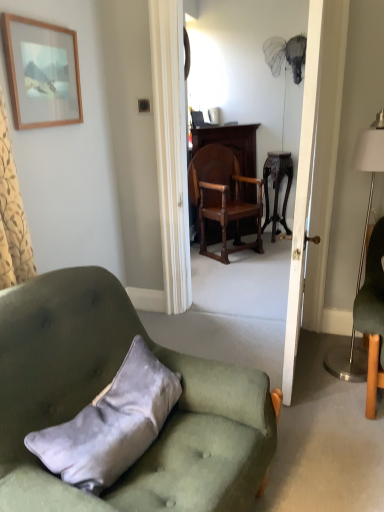
Question: Is there a large distance between silver metallic floor lamp at right and polished wood chair at center, which appears as the first chair when viewed from the top?

Choices:
 (A) yes
 (B) no

Answer: (A)

Question: Is silver metallic floor lamp at right behind polished wood chair at center, acting as the 2th chair starting from the front?

Choices:
 (A) no
 (B) yes

Answer: (A)

Question: From the image's perspective, is silver metallic floor lamp at right located above polished wood chair at center, the second chair when ordered from bottom to top?

Choices:
 (A) no
 (B) yes

Answer: (A)

Question: Is silver metallic floor lamp at right thinner than polished wood chair at center, acting as the 2th chair starting from the front?

Choices:
 (A) yes
 (B) no

Answer: (A)

Question: Would you say polished wood chair at center, the second chair when ordered from bottom to top, is part of silver metallic floor lamp at right's contents?

Choices:
 (A) no
 (B) yes

Answer: (A)

Question: Is silver metallic floor lamp at right located outside polished wood chair at center, the second chair when ordered from bottom to top?

Choices:
 (A) yes
 (B) no

Answer: (A)

Question: Can you confirm if polished wood chair at center, acting as the 2th chair starting from the front, is bigger than wooden picture frame at upper left?

Choices:
 (A) no
 (B) yes

Answer: (B)

Question: Does polished wood chair at center, the second chair when ordered from bottom to top, touch wooden picture frame at upper left?

Choices:
 (A) yes
 (B) no

Answer: (B)

Question: Is polished wood chair at center, the 1th chair viewed from the back, wider than wooden picture frame at upper left?

Choices:
 (A) yes
 (B) no

Answer: (A)

Question: Are polished wood chair at center, the 1th chair viewed from the back, and wooden picture frame at upper left located far from each other?

Choices:
 (A) yes
 (B) no

Answer: (A)

Question: Can you confirm if polished wood chair at center, the second chair when ordered from bottom to top, is positioned to the right of wooden picture frame at upper left?

Choices:
 (A) no
 (B) yes

Answer: (B)

Question: Considering the relative positions of polished wood chair at center, the second chair when ordered from bottom to top, and wooden picture frame at upper left in the image provided, is polished wood chair at center, the second chair when ordered from bottom to top, in front of wooden picture frame at upper left?

Choices:
 (A) no
 (B) yes

Answer: (A)

Question: Considering the relative sizes of white wooden door at center and polished wood chair at center, acting as the 2th chair starting from the front, in the image provided, is white wooden door at center taller than polished wood chair at center, acting as the 2th chair starting from the front,?

Choices:
 (A) yes
 (B) no

Answer: (A)